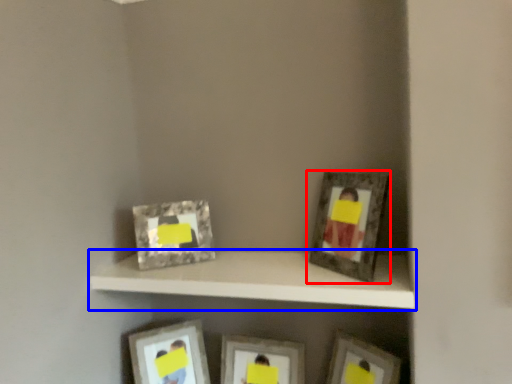
Question: Which object appears closest to the camera in this image, picture frame (highlighted by a red box) or shelf (highlighted by a blue box)?

Choices:
 (A) picture frame
 (B) shelf

Answer: (B)